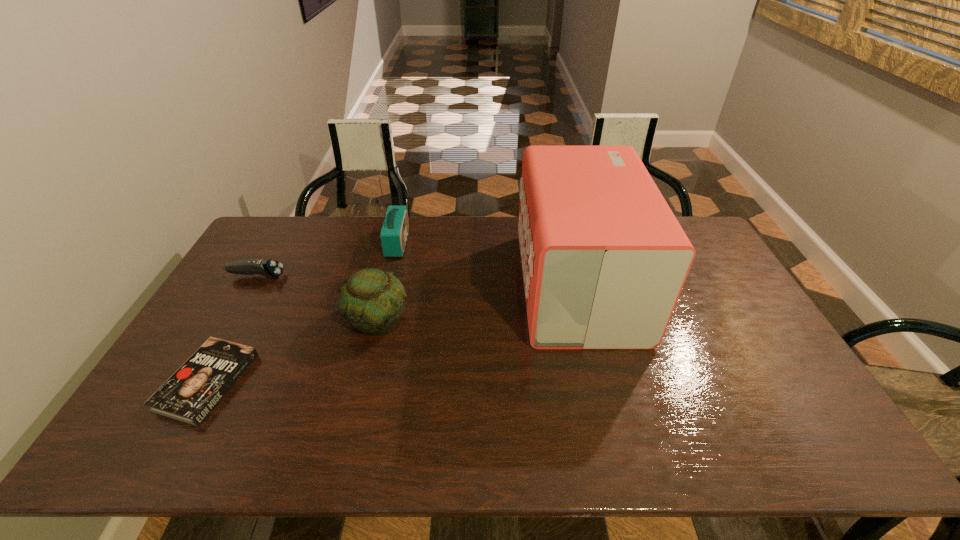
The width and height of the screenshot is (960, 540). What are the coordinates of `vacant space located on the back of the pottery` in the screenshot? It's located at (391, 264).

I want to click on blank space located 0.140m on the head of the fourth tallest object, so click(x=327, y=276).

At what (x,y) coordinates should I click in order to perform the action: click on vacant space positioned 0.340m on the back of the shortest object. Please return your answer as a coordinate pair (x, y). Looking at the image, I should click on (272, 267).

Locate an element on the screen. box that is at the far edge is located at coordinates (604, 260).

Locate an element on the screen. The width and height of the screenshot is (960, 540). radio receiver that is at the far edge is located at coordinates (394, 232).

Image resolution: width=960 pixels, height=540 pixels. Find the location of `object that is at the near edge`. object that is at the near edge is located at coordinates (191, 393).

Identify the location of electric shaver that is at the left edge. (269, 268).

I want to click on book located at the left edge, so click(191, 393).

I want to click on object present at the near left corner, so click(x=191, y=393).

Where is `vacant space at the far edge`? This screenshot has height=540, width=960. vacant space at the far edge is located at coordinates (492, 251).